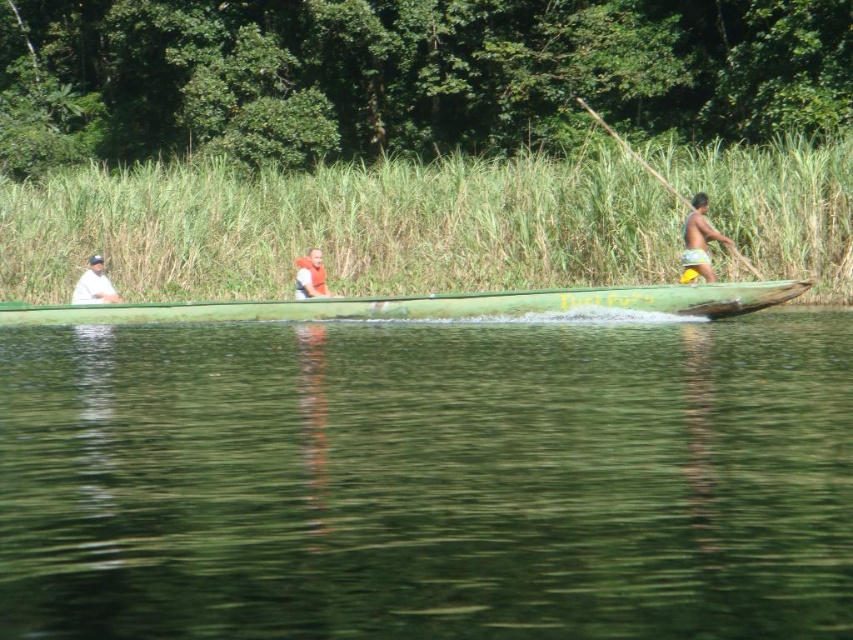
Can you confirm if green smooth water at center is taller than yellow fabric shorts at right?

Correct, green smooth water at center is much taller as yellow fabric shorts at right.

Can you confirm if green smooth water at center is positioned to the right of yellow fabric shorts at right?

No, green smooth water at center is not to the right of yellow fabric shorts at right.

Measure the distance between point (509, 477) and camera.

Point (509, 477) and camera are 8.42 meters apart.

The height and width of the screenshot is (640, 853). What are the coordinates of `green smooth water at center` in the screenshot? It's located at (428, 477).

Measure the distance between point (299, 284) and camera.

Point (299, 284) is 21.03 meters away from camera.

Can you confirm if orange life vest at center is positioned above wooden paddle at right?

Incorrect, orange life vest at center is not positioned above wooden paddle at right.

Who is more forward, (305,256) or (631,148)?

Point (305,256) is more forward.

The width and height of the screenshot is (853, 640). I want to click on orange life vest at center, so click(x=310, y=275).

Is yellow fabric shorts at right thinner than white fabric shirt at left?

Indeed, yellow fabric shorts at right has a lesser width compared to white fabric shirt at left.

At what (x,y) coordinates should I click in order to perform the action: click on yellow fabric shorts at right. Please return your answer as a coordinate pair (x, y). This screenshot has width=853, height=640. Looking at the image, I should click on (698, 241).

Is point (697, 230) positioned in front of point (109, 284)?

Yes, it is.

You are a GUI agent. You are given a task and a screenshot of the screen. Output one action in this format:
    pyautogui.click(x=<x>, y=<y>)
    Task: Click on the yellow fabric shorts at right
    
    Given the screenshot: What is the action you would take?
    pyautogui.click(x=698, y=241)